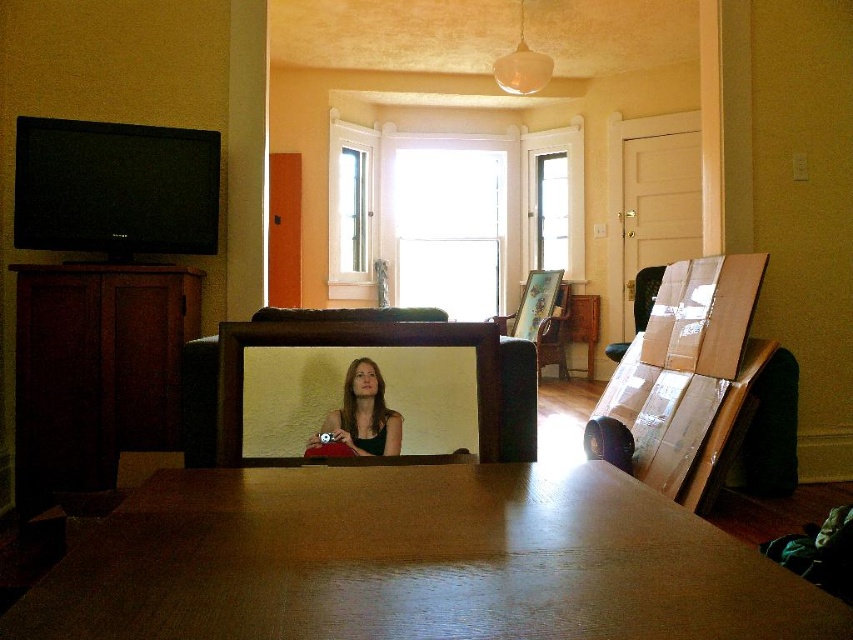
Between wooden table at center and matte black hair at center, which one appears on the left side from the viewer's perspective?

matte black hair at center

Can you confirm if wooden table at center is positioned to the left of matte black hair at center?

No, wooden table at center is not to the left of matte black hair at center.

Between point (630, 483) and point (370, 442), which one is positioned behind?

The point (370, 442) is behind.

This screenshot has height=640, width=853. What are the coordinates of `wooden table at center` in the screenshot? It's located at pyautogui.click(x=415, y=561).